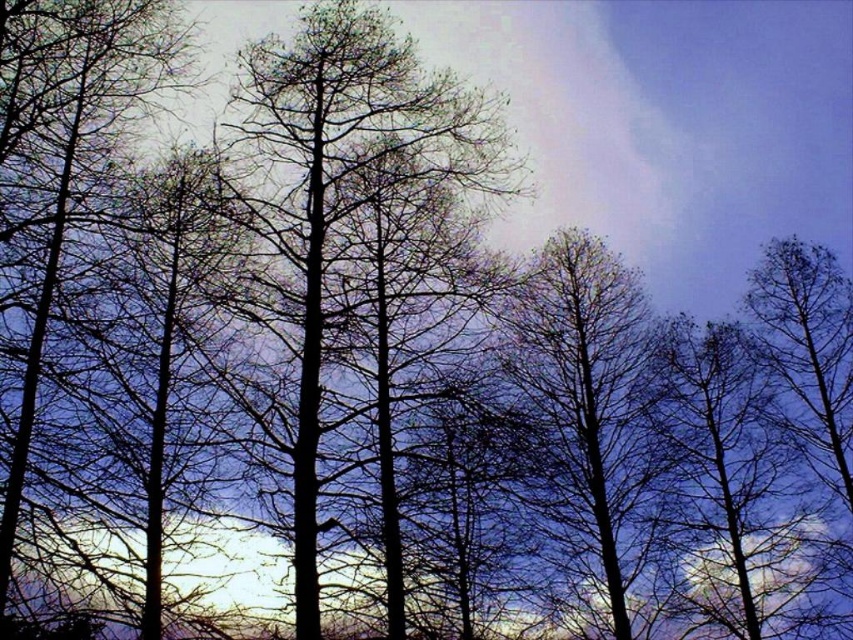
Between smooth bark tree at center and bare branches at center, which one has more height?

bare branches at center is taller.

Who is higher up, smooth bark tree at center or bare branches at center?

Positioned higher is smooth bark tree at center.

Is point (286, 131) positioned after point (624, 540)?

No, (286, 131) is in front of (624, 540).

Where is `smooth bark tree at center`? The height and width of the screenshot is (640, 853). smooth bark tree at center is located at coordinates (339, 196).

Consider the image. Is bare branches at center positioned in front of silhouette bare tree at left?

That is False.

Between bare branches at center and silhouette bare tree at left, which one appears on the left side from the viewer's perspective?

Positioned to the left is silhouette bare tree at left.

Describe the element at coordinates (583, 410) in the screenshot. I see `bare branches at center` at that location.

The image size is (853, 640). Identify the location of bare branches at center. (583, 410).

Between point (287, 61) and point (149, 48), which one is positioned behind?

Point (149, 48)

Who is more forward, (384, 116) or (142, 26)?

Point (142, 26) is in front.

Where is `smooth bark tree at center`? The width and height of the screenshot is (853, 640). smooth bark tree at center is located at coordinates (339, 196).